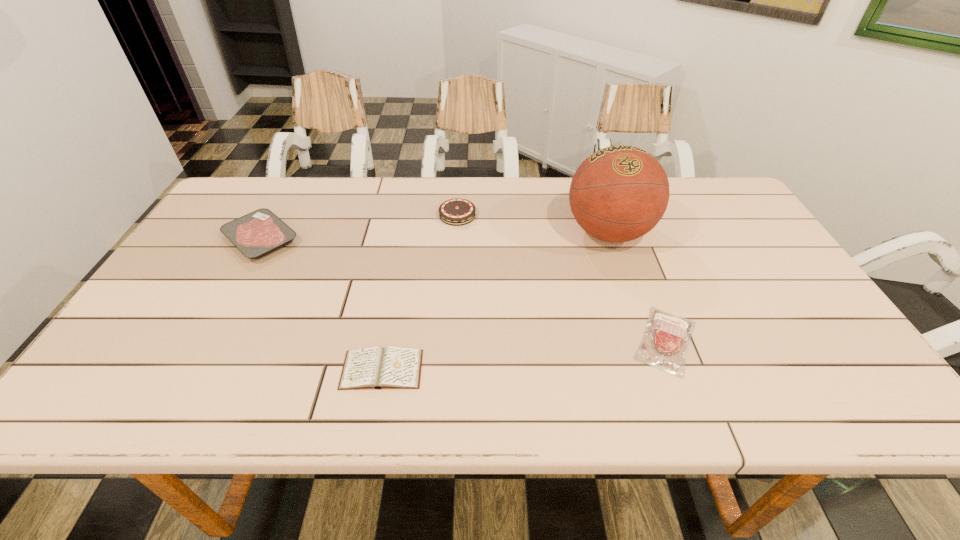
Identify the location of vacant area situated 0.050m on the back of the nearer steak. The width and height of the screenshot is (960, 540). (647, 292).

This screenshot has height=540, width=960. In order to click on free location located on the left of the diary in this screenshot , I will do `click(156, 369)`.

Locate an element on the screen. This screenshot has height=540, width=960. basketball that is at the far edge is located at coordinates (619, 193).

The image size is (960, 540). Identify the location of chocolate cake located in the far edge section of the desktop. pos(455,212).

Locate an element on the screen. Image resolution: width=960 pixels, height=540 pixels. steak that is at the far edge is located at coordinates (256, 234).

Where is `steak at the near edge`? Image resolution: width=960 pixels, height=540 pixels. steak at the near edge is located at coordinates (664, 345).

You are a GUI agent. You are given a task and a screenshot of the screen. Output one action in this format:
    pyautogui.click(x=<x>, y=<y>)
    Task: Click on the diary that is at the near edge
    The height and width of the screenshot is (540, 960).
    Given the screenshot: What is the action you would take?
    pyautogui.click(x=375, y=367)

Locate an element on the screen. This screenshot has width=960, height=540. object positioned at the left edge is located at coordinates (256, 234).

I want to click on object situated at the far left corner, so click(256, 234).

Locate an element on the screen. The width and height of the screenshot is (960, 540). vacant area at the far edge of the desktop is located at coordinates (510, 189).